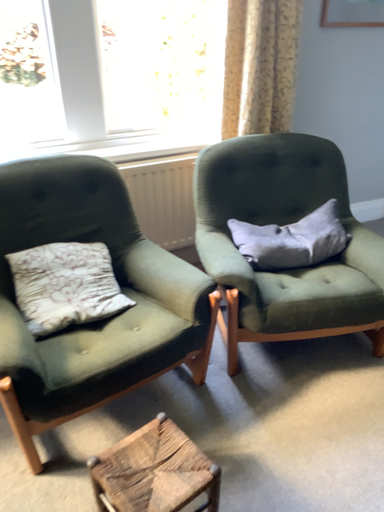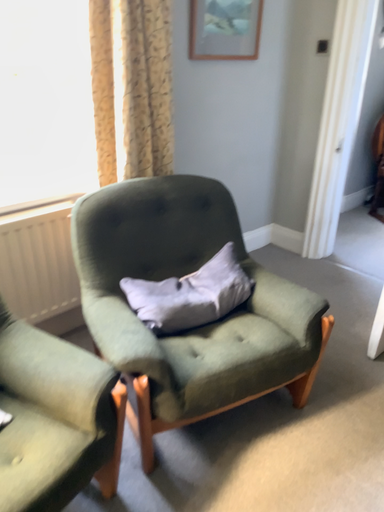
Question: How did the camera likely rotate when shooting the video?

Choices:
 (A) rotated right
 (B) rotated left

Answer: (A)